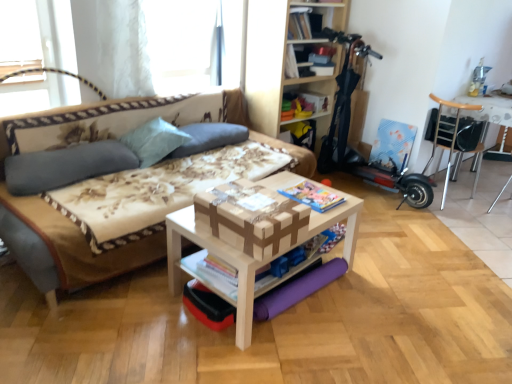
Identify the location of vacant area that is in front of white wood table at center, placed as the first table when sorted from bottom to top. The width and height of the screenshot is (512, 384). (266, 351).